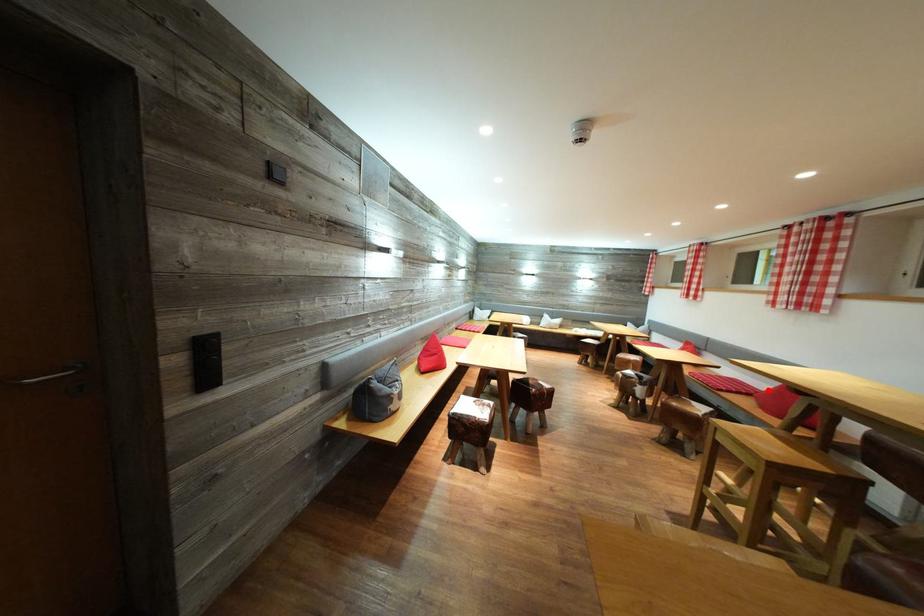
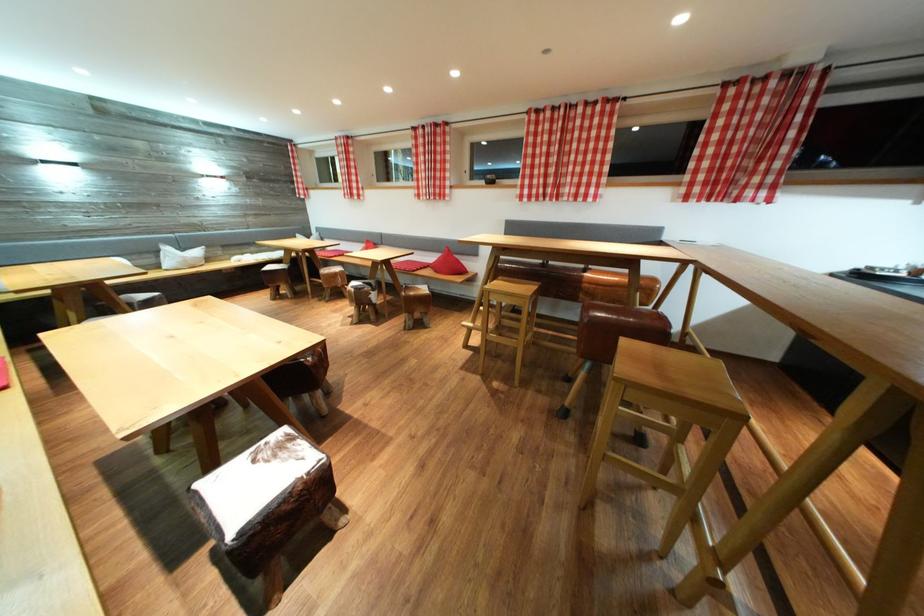
Question: I am providing you with two images of the same scene from different viewpoints. A red point is shown in image1. For the corresponding object point in image2, is it positioned nearer or farther from the camera?

Choices:
 (A) Nearer
 (B) Farther

Answer: (A)